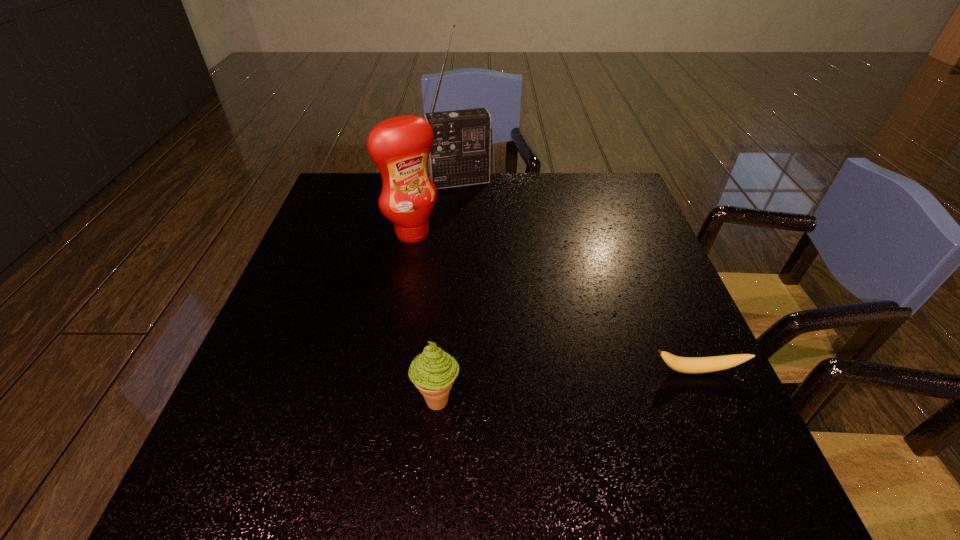
The width and height of the screenshot is (960, 540). I want to click on blank region between the second tallest object and the banana, so click(555, 301).

Where is `free space that is in between the shortest object and the second shortest object`? The height and width of the screenshot is (540, 960). free space that is in between the shortest object and the second shortest object is located at coordinates (567, 385).

Where is `free space between the banana and the farthest object`? The width and height of the screenshot is (960, 540). free space between the banana and the farthest object is located at coordinates (579, 276).

At what (x,y) coordinates should I click in order to perform the action: click on free space between the third farthest object and the nearest object. Please return your answer as a coordinate pair (x, y). Looking at the image, I should click on (567, 385).

Select which object is the closest to the condiment. Please provide its 2D coordinates. Your answer should be formatted as a tuple, i.e. [(x, y)], where the tuple contains the x and y coordinates of a point satisfying the conditions above.

[(462, 146)]

Where is `the second closest object relative to the third farthest object`? This screenshot has width=960, height=540. the second closest object relative to the third farthest object is located at coordinates (400, 146).